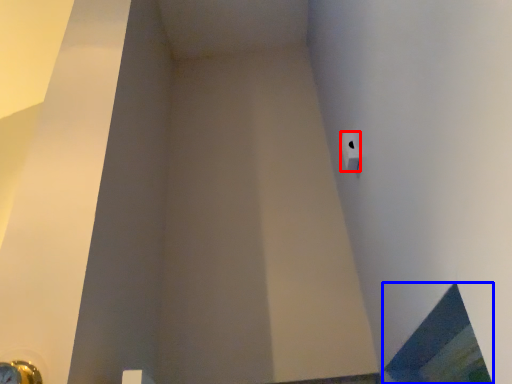
Question: Which object appears closest to the camera in this image, toilet paper (highlighted by a red box) or window (highlighted by a blue box)?

Choices:
 (A) toilet paper
 (B) window

Answer: (B)